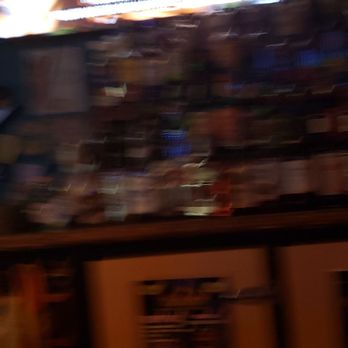
Locate an element on the screen. This screenshot has height=348, width=348. white frames is located at coordinates [160, 265], [332, 253].